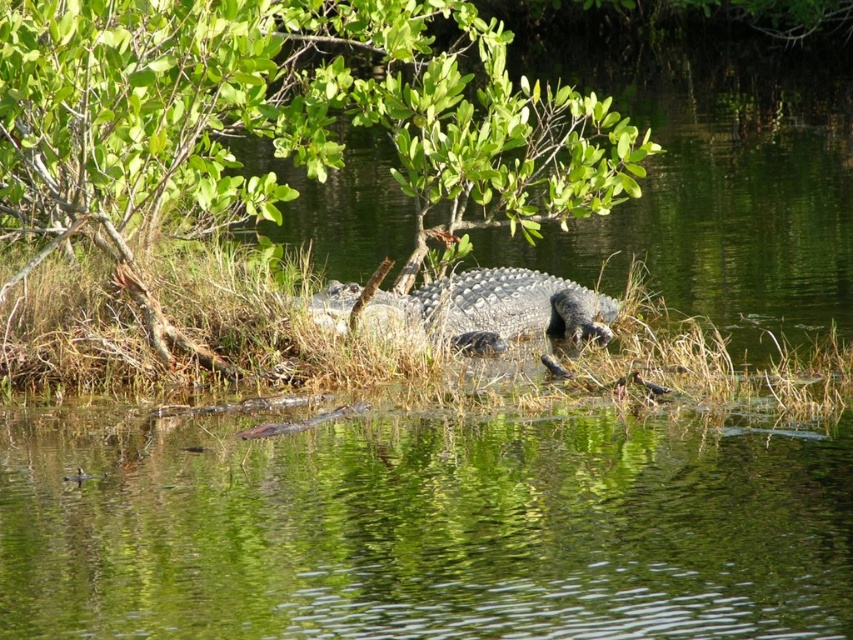
How far apart are green reflective water at center and green leafy tree at center?

green reflective water at center and green leafy tree at center are 15.23 feet apart.

Does green reflective water at center appear over green leafy tree at center?

No.

Does point (521, 483) lie behind point (253, 88)?

No, (521, 483) is closer to viewer.

Where is `green reflective water at center`? This screenshot has height=640, width=853. green reflective water at center is located at coordinates (422, 529).

Is green rough grass at center bigger than scaly gray crocodile at center?

Actually, green rough grass at center might be smaller than scaly gray crocodile at center.

Does green rough grass at center have a lesser height compared to scaly gray crocodile at center?

Correct, green rough grass at center is not as tall as scaly gray crocodile at center.

Who is more distant from viewer, (178, 282) or (492, 289)?

The point (492, 289) is more distant.

Where is `green rough grass at center`? This screenshot has height=640, width=853. green rough grass at center is located at coordinates (183, 328).

From the picture: Who is higher up, green reflective water at center or green rough grass at center?

green rough grass at center

Identify the location of green reflective water at center. (422, 529).

Image resolution: width=853 pixels, height=640 pixels. Identify the location of green reflective water at center. (422, 529).